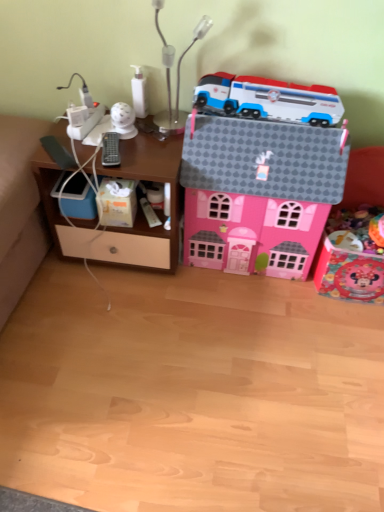
Describe the element at coordinates (139, 93) in the screenshot. I see `white glossy bottle at upper center, positioned as the 5th toy in right-to-left order` at that location.

Measure the distance between point (201, 115) and camera.

Point (201, 115) is 4.39 feet away from camera.

What do you see at coordinates (258, 192) in the screenshot?
I see `pink cardboard house at center, which appears as the 2th toy when viewed from the right` at bounding box center [258, 192].

Find the location of `white glossy security camera at upper center, the sixth toy positioned from the right`. white glossy security camera at upper center, the sixth toy positioned from the right is located at coordinates (123, 120).

At what (x,y) coordinates should I click in order to perform the action: click on toy that is the 1st one when counting leftward from the pink cardboard house at center, which appears as the 2th toy when viewed from the right. Please return your answer as a coordinate pair (x, y). This screenshot has height=512, width=384. Looking at the image, I should click on (267, 99).

Does point (304, 174) appear closer or farther from the camera than point (270, 112)?

Point (304, 174) is positioned closer to the camera compared to point (270, 112).

Considering the relative sizes of pink cardboard house at center, which appears as the 2th toy when viewed from the right, and white plastic train at upper center, which is the 3th toy in right-to-left order, in the image provided, is pink cardboard house at center, which appears as the 2th toy when viewed from the right, wider than white plastic train at upper center, which is the 3th toy in right-to-left order,?

Indeed, pink cardboard house at center, which appears as the 2th toy when viewed from the right, has a greater width compared to white plastic train at upper center, which is the 3th toy in right-to-left order.

Is pink cardboard house at center, the 5th toy from the left, far from white plastic train at upper center, arranged as the fourth toy when viewed from the left?

No, pink cardboard house at center, the 5th toy from the left, is not far from white plastic train at upper center, arranged as the fourth toy when viewed from the left.

Is shiny pink toy house at right, which is the 1th toy from right to left, located outside white plastic container at lower center, the 3th toy when ordered from left to right?

Yes, shiny pink toy house at right, which is the 1th toy from right to left, is not within white plastic container at lower center, the 3th toy when ordered from left to right.

Which is less distant, (x=344, y=278) or (x=148, y=217)?

The point (x=148, y=217) is closer.

How distant is shiny pink toy house at right, which is the 1th toy from right to left, from white plastic container at lower center, the 3th toy when ordered from left to right?

27.03 inches.

Image resolution: width=384 pixels, height=512 pixels. There is a shiny pink toy house at right, which is the 1th toy from right to left. Find the location of `the 1st toy above it (from a real-world perspective)`. the 1st toy above it (from a real-world perspective) is located at coordinates (149, 213).

Does white glossy security camera at upper center, the sixth toy positioned from the right, have a greater height compared to white glossy bottle at upper center, positioned as the 5th toy in right-to-left order?

No, white glossy security camera at upper center, the sixth toy positioned from the right, is not taller than white glossy bottle at upper center, positioned as the 5th toy in right-to-left order.

Between white glossy security camera at upper center, which is counted as the first toy, starting from the left, and white glossy bottle at upper center, positioned as the 5th toy in right-to-left order, which one has smaller width?

white glossy bottle at upper center, positioned as the 5th toy in right-to-left order, is thinner.

From the image's perspective, between white glossy security camera at upper center, which is counted as the first toy, starting from the left, and white glossy bottle at upper center, positioned as the 5th toy in right-to-left order, which one is located above?

white glossy bottle at upper center, positioned as the 5th toy in right-to-left order, from the image's perspective.

From a real-world perspective, is white glossy security camera at upper center, the sixth toy positioned from the right, physically below metallic silver table lamp at upper center?

Yes, from a real-world perspective, white glossy security camera at upper center, the sixth toy positioned from the right, is beneath metallic silver table lamp at upper center.

Which object is positioned more to the left, white glossy security camera at upper center, which is counted as the first toy, starting from the left, or metallic silver table lamp at upper center?

white glossy security camera at upper center, which is counted as the first toy, starting from the left, is more to the left.

Is white glossy security camera at upper center, the sixth toy positioned from the right, facing towards metallic silver table lamp at upper center?

No, white glossy security camera at upper center, the sixth toy positioned from the right, is not facing towards metallic silver table lamp at upper center.

How many degrees apart are the facing directions of white glossy security camera at upper center, the sixth toy positioned from the right, and metallic silver table lamp at upper center?

They differ by 0.458 degrees in their facing directions.

Is pink cardboard house at center, the 5th toy from the left, wider than woodenmaterial/texturecomputer desk at left?

No, pink cardboard house at center, the 5th toy from the left, is not wider than woodenmaterial/texturecomputer desk at left.

Is woodenmaterial/texturecomputer desk at left inside pink cardboard house at center, the 5th toy from the left?

No, pink cardboard house at center, the 5th toy from the left, does not contain woodenmaterial/texturecomputer desk at left.

Are pink cardboard house at center, which appears as the 2th toy when viewed from the right, and woodenmaterial/texturecomputer desk at left far apart?

That's not correct — pink cardboard house at center, which appears as the 2th toy when viewed from the right, is a little close to woodenmaterial/texturecomputer desk at left.

The height and width of the screenshot is (512, 384). Identify the location of the 5th toy counting from the right side of the woodenmaterial/texturecomputer desk at left. (258, 192).

Which object is further away from the camera, white plastic train at upper center, which is the 3th toy in right-to-left order, or pink cardboard house at center, the 5th toy from the left?

Positioned behind is white plastic train at upper center, which is the 3th toy in right-to-left order.

Is white plastic train at upper center, arranged as the fourth toy when viewed from the left, positioned far away from pink cardboard house at center, the 5th toy from the left?

That's not correct — white plastic train at upper center, arranged as the fourth toy when viewed from the left, is a little close to pink cardboard house at center, the 5th toy from the left.

Considering the sizes of white plastic train at upper center, arranged as the fourth toy when viewed from the left, and pink cardboard house at center, the 5th toy from the left, in the image, is white plastic train at upper center, arranged as the fourth toy when viewed from the left, wider or thinner than pink cardboard house at center, the 5th toy from the left,?

Considering their sizes, white plastic train at upper center, arranged as the fourth toy when viewed from the left, looks slimmer than pink cardboard house at center, the 5th toy from the left.

Do you think white plastic train at upper center, arranged as the fourth toy when viewed from the left, is within pink cardboard house at center, the 5th toy from the left, or outside of it?

white plastic train at upper center, arranged as the fourth toy when viewed from the left, is inside pink cardboard house at center, the 5th toy from the left.

Is white glossy bottle at upper center, positioned as the 5th toy in right-to-left order, aimed at woodenmaterial/texturecomputer desk at left?

No, white glossy bottle at upper center, positioned as the 5th toy in right-to-left order, is not facing towards woodenmaterial/texturecomputer desk at left.

From the image's perspective, which one is positioned higher, white glossy bottle at upper center, the second toy positioned from the left, or woodenmaterial/texturecomputer desk at left?

white glossy bottle at upper center, the second toy positioned from the left, from the image's perspective.

From their relative heights in the image, would you say white glossy bottle at upper center, positioned as the 5th toy in right-to-left order, is taller or shorter than woodenmaterial/texturecomputer desk at left?

white glossy bottle at upper center, positioned as the 5th toy in right-to-left order, is shorter than woodenmaterial/texturecomputer desk at left.

From a real-world perspective, which toy is the 3rd one underneath the white plastic train at upper center, arranged as the fourth toy when viewed from the left? Please provide its 2D coordinates.

[(258, 192)]

Where is `toy that is the 1st object located above the shiny pink toy house at right, which appears as the 6th toy when viewed from the left (from the image's perspective)`? toy that is the 1st object located above the shiny pink toy house at right, which appears as the 6th toy when viewed from the left (from the image's perspective) is located at coordinates (149, 213).

Based on their spatial positions, is white glossy bottle at upper center, positioned as the 5th toy in right-to-left order, or white glossy security camera at upper center, which is counted as the first toy, starting from the left, closer to white matte tissue box at lower left?

white glossy security camera at upper center, which is counted as the first toy, starting from the left.

Estimate the real-world distances between objects in this image. Which object is closer to white glossy bottle at upper center, the second toy positioned from the left, pink cardboard house at center, which appears as the 2th toy when viewed from the right, or metallic silver table lamp at upper center?

The object closer to white glossy bottle at upper center, the second toy positioned from the left, is metallic silver table lamp at upper center.

Based on their spatial positions, is white glossy security camera at upper center, which is counted as the first toy, starting from the left, or pink cardboard house at center, the 5th toy from the left, closer to white glossy bottle at upper center, positioned as the 5th toy in right-to-left order?

white glossy security camera at upper center, which is counted as the first toy, starting from the left, is closer to white glossy bottle at upper center, positioned as the 5th toy in right-to-left order.

Considering their positions, is white glossy bottle at upper center, positioned as the 5th toy in right-to-left order, positioned further to white matte tissue box at lower left than metallic silver table lamp at upper center?

metallic silver table lamp at upper center is positioned further to the anchor white matte tissue box at lower left.

Looking at the image, which one is located closer to white glossy bottle at upper center, positioned as the 5th toy in right-to-left order, woodenmaterial/texturecomputer desk at left or white matte tissue box at lower left?

The object closer to white glossy bottle at upper center, positioned as the 5th toy in right-to-left order, is white matte tissue box at lower left.

Looking at the image, which one is located closer to white glossy bottle at upper center, positioned as the 5th toy in right-to-left order, metallic silver table lamp at upper center or woodenmaterial/texturecomputer desk at left?

metallic silver table lamp at upper center.

When comparing their distances from woodenmaterial/texturecomputer desk at left, does shiny pink toy house at right, which appears as the 6th toy when viewed from the left, or white plastic container at lower center, the 3th toy when ordered from left to right, seem closer?

The object closer to woodenmaterial/texturecomputer desk at left is white plastic container at lower center, the 3th toy when ordered from left to right.

When comparing their distances from metallic silver table lamp at upper center, does woodenmaterial/texturecomputer desk at left or white plastic train at upper center, which is the 3th toy in right-to-left order, seem closer?

white plastic train at upper center, which is the 3th toy in right-to-left order, is closer to metallic silver table lamp at upper center.

The height and width of the screenshot is (512, 384). I want to click on table lamp between white glossy security camera at upper center, which is counted as the first toy, starting from the left, and white plastic train at upper center, arranged as the fourth toy when viewed from the left, so click(177, 74).

Find the location of a particular element. table lamp between white matte tissue box at lower left and pink cardboard house at center, which appears as the 2th toy when viewed from the right, from left to right is located at coordinates (177, 74).

I want to click on cardboard box between white glossy bottle at upper center, positioned as the 5th toy in right-to-left order, and white plastic container at lower center, the fourth toy positioned from the right, vertically, so click(x=116, y=202).

This screenshot has width=384, height=512. I want to click on table lamp between white glossy bottle at upper center, positioned as the 5th toy in right-to-left order, and shiny pink toy house at right, which appears as the 6th toy when viewed from the left, from left to right, so click(177, 74).